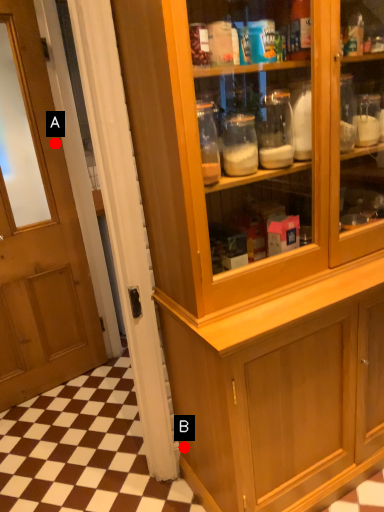
Question: Two points are circled on the image, labeled by A and B beside each circle. Among these points, which one is nearest to the camera?

Choices:
 (A) A is closer
 (B) B is closer

Answer: (B)